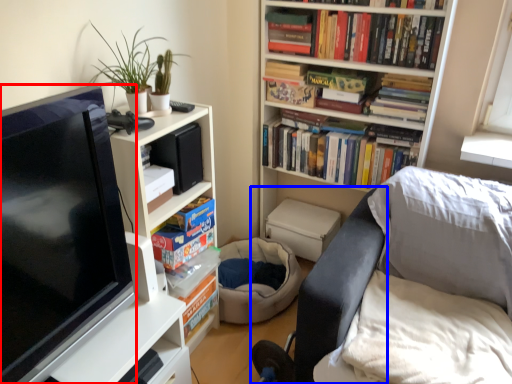
Question: Among these objects, which one is nearest to the camera, television (highlighted by a red box) or swivel chair (highlighted by a blue box)?

Choices:
 (A) television
 (B) swivel chair

Answer: (A)